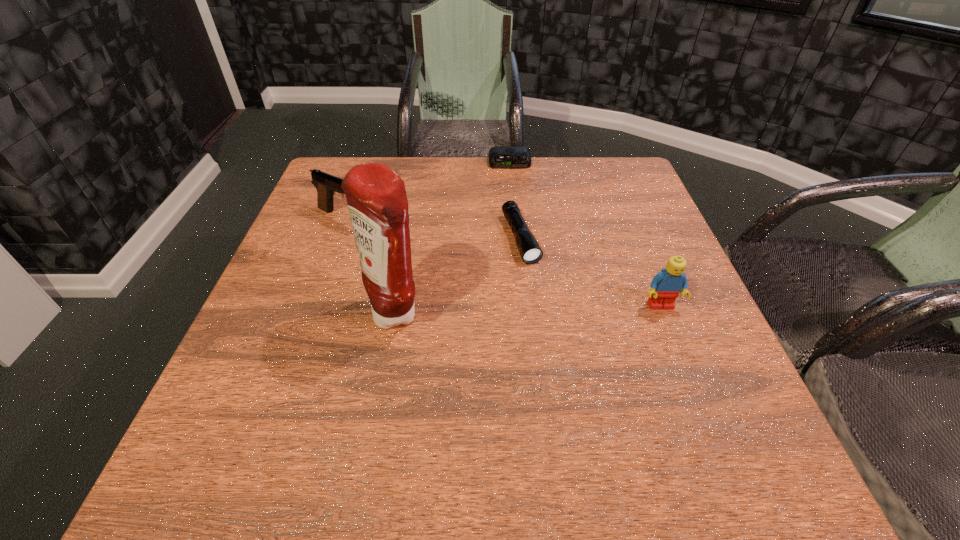
Where is `vacant spot on the desktop that is between the tallest object and the rightmost object and is positioned on the display of the shortest object`? This screenshot has height=540, width=960. vacant spot on the desktop that is between the tallest object and the rightmost object and is positioned on the display of the shortest object is located at coordinates (525, 309).

I want to click on free space on the desktop that is between the tallest object and the rightmost object and is positioned at the lens end of the flashlight, so click(554, 309).

Where is `vacant spot on the desktop that is between the second object from left to right and the Lego and is positioned at the muzzle of the pistol`? This screenshot has width=960, height=540. vacant spot on the desktop that is between the second object from left to right and the Lego and is positioned at the muzzle of the pistol is located at coordinates 564,308.